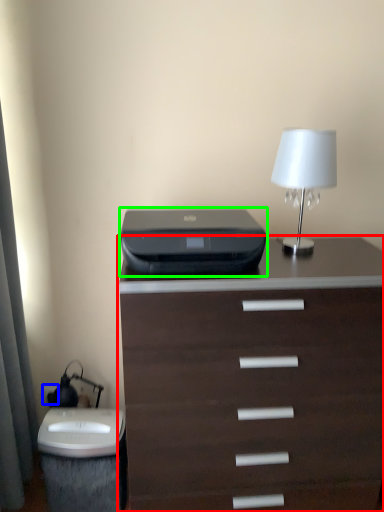
Question: Which object is positioned farthest from chest of drawers (highlighted by a red box)? Select from electric outlet (highlighted by a blue box) and printer (highlighted by a green box).

Choices:
 (A) electric outlet
 (B) printer

Answer: (A)